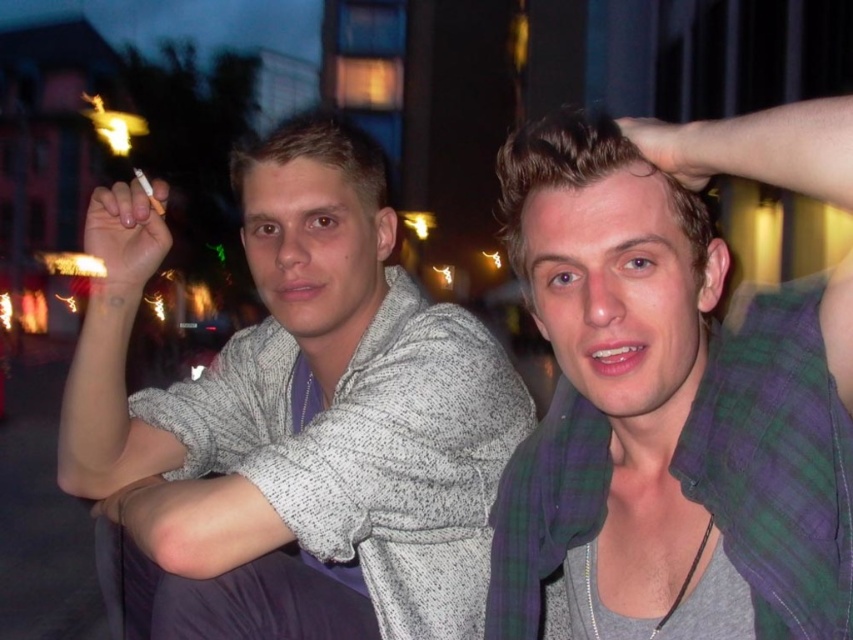
Is speckled gray sweater at left below smooth skin hand at upper right?

Correct, speckled gray sweater at left is located below smooth skin hand at upper right.

In order to click on speckled gray sweater at left in this screenshot , I will do `click(312, 410)`.

Can you confirm if white matte cigarette at upper left is shorter than smooth skin hand at upper right?

In fact, white matte cigarette at upper left may be taller than smooth skin hand at upper right.

Can you confirm if white matte cigarette at upper left is thinner than smooth skin hand at upper right?

No, white matte cigarette at upper left is not thinner than smooth skin hand at upper right.

This screenshot has width=853, height=640. Find the location of `white matte cigarette at upper left`. white matte cigarette at upper left is located at coordinates (126, 236).

Is green plaid scarf at upper right wider than speckled gray sweater at left?

No, green plaid scarf at upper right is not wider than speckled gray sweater at left.

Does green plaid scarf at upper right have a lesser height compared to speckled gray sweater at left?

Yes.

Identify the location of green plaid scarf at upper right. Image resolution: width=853 pixels, height=640 pixels. (666, 413).

This screenshot has width=853, height=640. I want to click on green plaid scarf at upper right, so click(x=666, y=413).